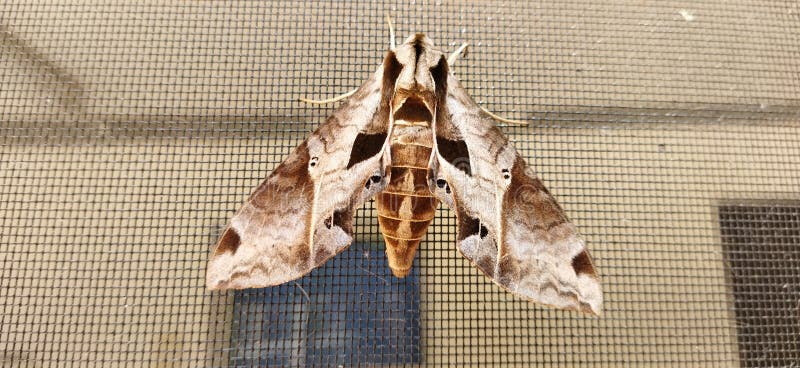
Identify the location of window. The height and width of the screenshot is (368, 800). (325, 351).